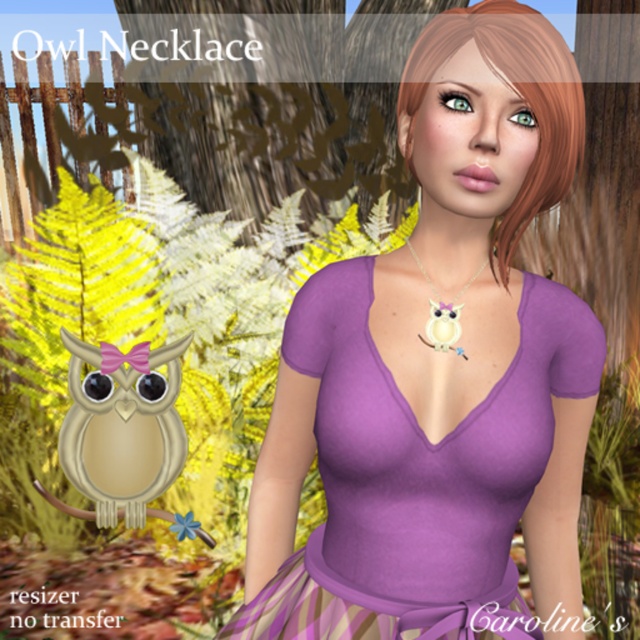
Does matte beige owl at center have a lesser width compared to matte white owl at center?

No, matte beige owl at center is not thinner than matte white owl at center.

Measure the distance between matte beige owl at center and matte white owl at center.

matte beige owl at center is 2.04 meters from matte white owl at center.

Who is more forward, [161,432] or [440,342]?

Positioned in front is point [440,342].

The height and width of the screenshot is (640, 640). I want to click on matte beige owl at center, so click(x=122, y=429).

Is point (528, 468) positioned before point (163, 356)?

Yes, it is.

Does point (372, 460) lie behind point (102, 449)?

That is False.

You are a GUI agent. You are given a task and a screenshot of the screen. Output one action in this format:
    pyautogui.click(x=<x>, y=<y>)
    Task: Click on the purple matte dress at center
    
    Given the screenshot: What is the action you would take?
    pyautogui.click(x=416, y=467)

The height and width of the screenshot is (640, 640). Identify the location of purple matte dress at center. (416, 467).

Is purple matte dress at center wider than matte white owl at center?

Indeed, purple matte dress at center has a greater width compared to matte white owl at center.

Who is more forward, (x=337, y=570) or (x=452, y=301)?

Positioned in front is point (x=452, y=301).

This screenshot has height=640, width=640. I want to click on purple matte dress at center, so click(416, 467).